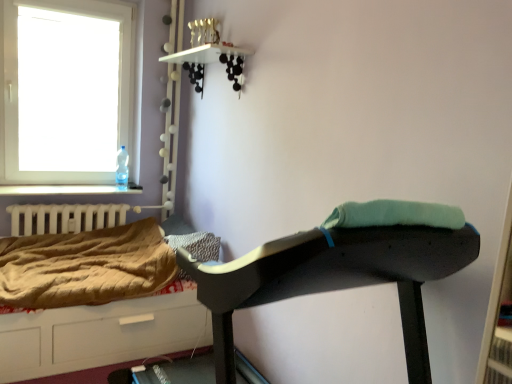
Question: From the image's perspective, would you say matte black ironing board at center is shown under brown quilted blanket at lower left?

Choices:
 (A) no
 (B) yes

Answer: (B)

Question: Considering the relative sizes of matte black ironing board at center and brown quilted blanket at lower left in the image provided, is matte black ironing board at center wider than brown quilted blanket at lower left?

Choices:
 (A) yes
 (B) no

Answer: (B)

Question: Is matte black ironing board at center thinner than brown quilted blanket at lower left?

Choices:
 (A) yes
 (B) no

Answer: (A)

Question: Is matte black ironing board at center smaller than brown quilted blanket at lower left?

Choices:
 (A) no
 (B) yes

Answer: (A)

Question: From the image's perspective, does matte black ironing board at center appear higher than brown quilted blanket at lower left?

Choices:
 (A) no
 (B) yes

Answer: (A)

Question: Does matte black ironing board at center come in front of brown quilted blanket at lower left?

Choices:
 (A) yes
 (B) no

Answer: (A)

Question: From the image's perspective, is brown quilted hospital bed at lower left located beneath transparent plastic bottle at window left?

Choices:
 (A) no
 (B) yes

Answer: (B)

Question: Does brown quilted hospital bed at lower left have a lesser height compared to transparent plastic bottle at window left?

Choices:
 (A) yes
 (B) no

Answer: (B)

Question: Is brown quilted hospital bed at lower left outside of transparent plastic bottle at window left?

Choices:
 (A) yes
 (B) no

Answer: (A)

Question: Is brown quilted hospital bed at lower left to the left of transparent plastic bottle at window left from the viewer's perspective?

Choices:
 (A) no
 (B) yes

Answer: (A)

Question: Can you confirm if brown quilted hospital bed at lower left is taller than transparent plastic bottle at window left?

Choices:
 (A) no
 (B) yes

Answer: (B)

Question: Is brown quilted hospital bed at lower left placed right next to transparent plastic bottle at window left?

Choices:
 (A) yes
 (B) no

Answer: (B)

Question: From the image's perspective, is brown quilted hospital bed at lower left beneath matte black ironing board at center?

Choices:
 (A) no
 (B) yes

Answer: (B)